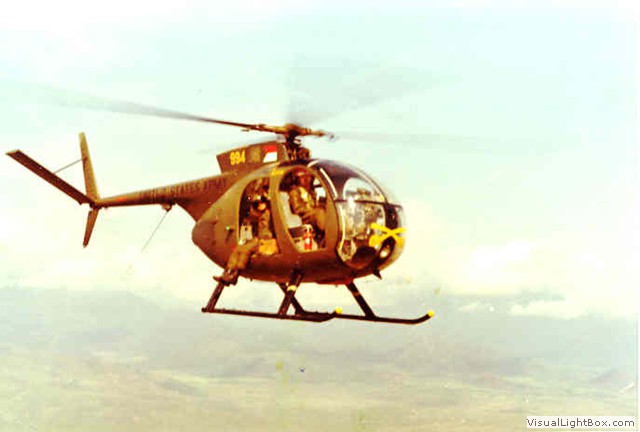
What are the coordinates of `window` in the screenshot? It's located at (361, 187), (388, 240).